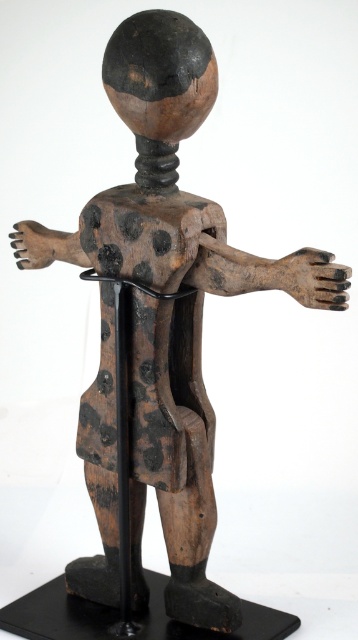
You are examining the wooden figurine and notice two points marked on it. The first point is at coordinates point (326, 282) and the second is at point (30, 234). Which of these points is nearer to you as you look at the figurine?

Point (326, 282) is closer to the camera than point (30, 234), so the first point is nearer to you.

You are an art conservator examining the wooden figurine. You notice two points on the figurine marked at coordinates point (x=114, y=321) and point (x=297, y=273). From your perspective, which point is closer to you?

Point (x=297, y=273) is closer to you because point (x=114, y=321) is behind it.

You are an art conservator examining the wooden figurine. You notice the black wood pole at center and the brown wood hand at left. Which object is positioned to the right of the other?

The black wood pole at center is to the right of the brown wood hand at left according to the description.